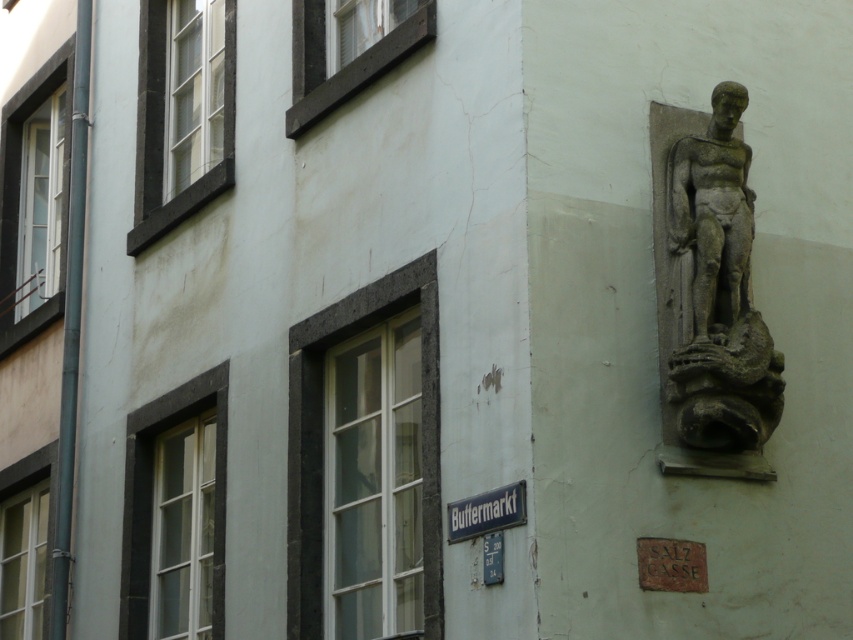
Consider the image. You are a delivery person trying to park your 1.2 meter wide van between the gray stone statue at upper right and the metallic blue street sign at center. Can you fit your van there based on the available space?

The gray stone statue at upper right might be wider than metallic blue street sign at center, so there is uncertainty about the available space. It is possible that the width between them is less than 1.2 meters, making it risky to attempt parking the van there.

You are standing in front of the building and notice the gray stone statue at upper right and the metallic blue street sign at center. Which object is closer to you?

The gray stone statue at upper right is closer to you because it is further to the viewer than the metallic blue street sign at center.

You are a delivery person trying to locate the entrance to the building. You see the gray stone statue at upper right and the metallic blue street sign at center. According to the building layout, which object is closer to the entrance?

The gray stone statue at upper right is positioned on the right side of the metallic blue street sign at center, so the metallic blue street sign at center is closer to the entrance than the statue.